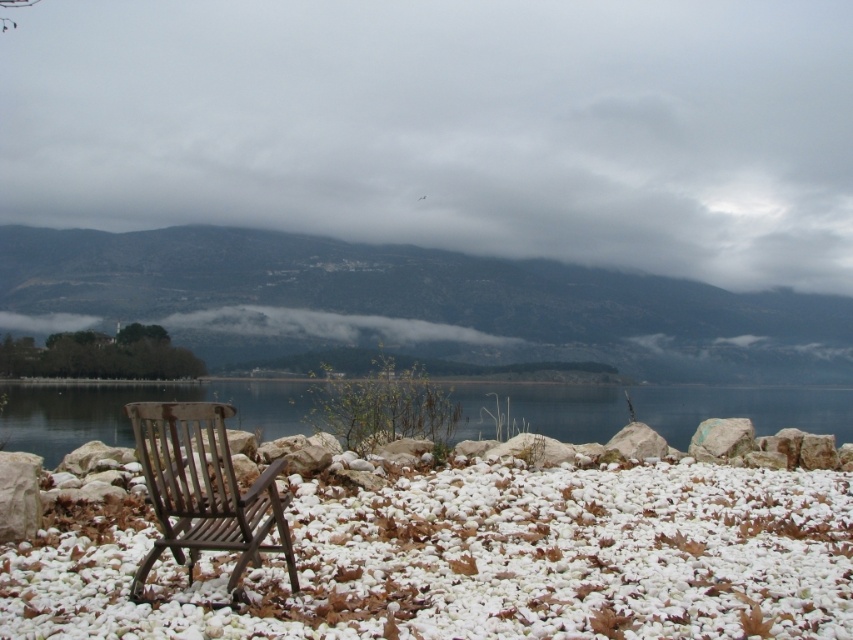
Question: Which point is closer to the camera?

Choices:
 (A) (143, 620)
 (B) (685, 397)
 (C) (262, 532)

Answer: (A)

Question: Is white gravel at center further to camera compared to transparent glass water at center?

Choices:
 (A) no
 (B) yes

Answer: (A)

Question: Is transparent glass water at center positioned at the back of wooden chair at lower left?

Choices:
 (A) no
 (B) yes

Answer: (B)

Question: Which object is farther from the camera taking this photo?

Choices:
 (A) dark green forested mountain at left
 (B) transparent glass water at center
 (C) white gravel at center

Answer: (A)

Question: Among these objects, which one is nearest to the camera?

Choices:
 (A) white gravel at center
 (B) wooden chair at lower left
 (C) dark green forested mountain at left
 (D) transparent glass water at center

Answer: (A)

Question: Is dark green forested mountain at left above wooden chair at lower left?

Choices:
 (A) no
 (B) yes

Answer: (B)